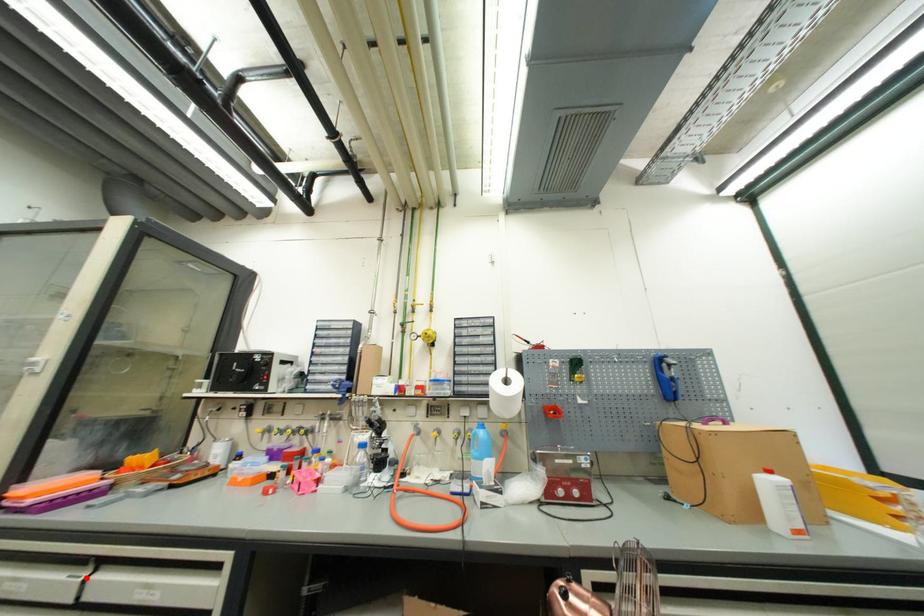
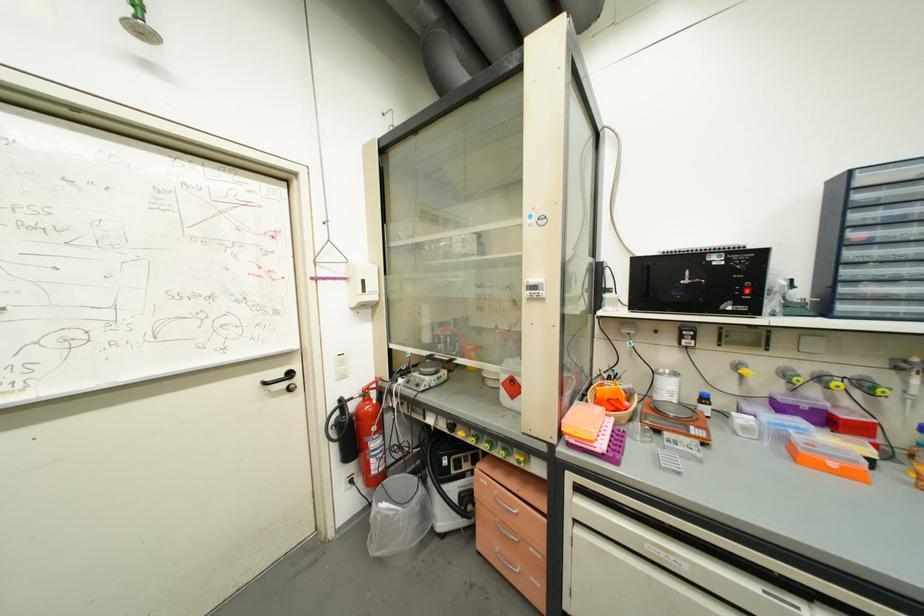
Question: I am providing you with two images of the same scene from different viewpoints. A red point is shown in image1. For the corresponding object point in image2, is it positioned nearer or farther from the camera?

Choices:
 (A) Nearer
 (B) Farther

Answer: (B)